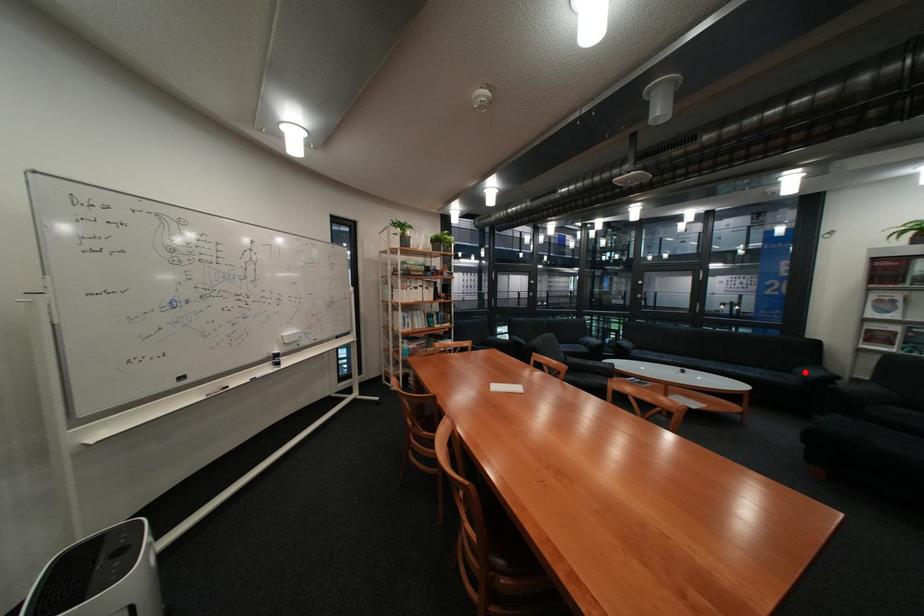
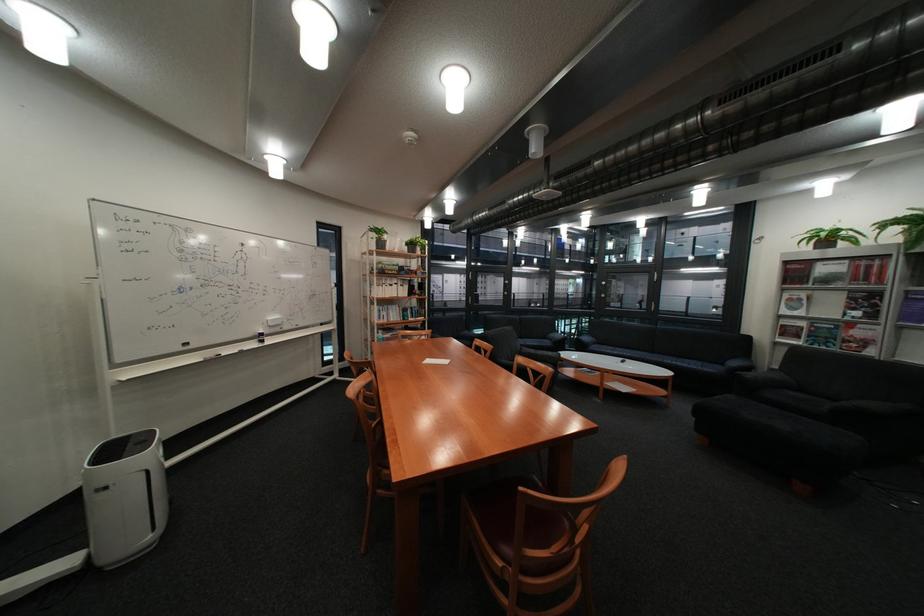
Find the pixel in the second image that matches the highlighted location in the first image.

(737, 363)